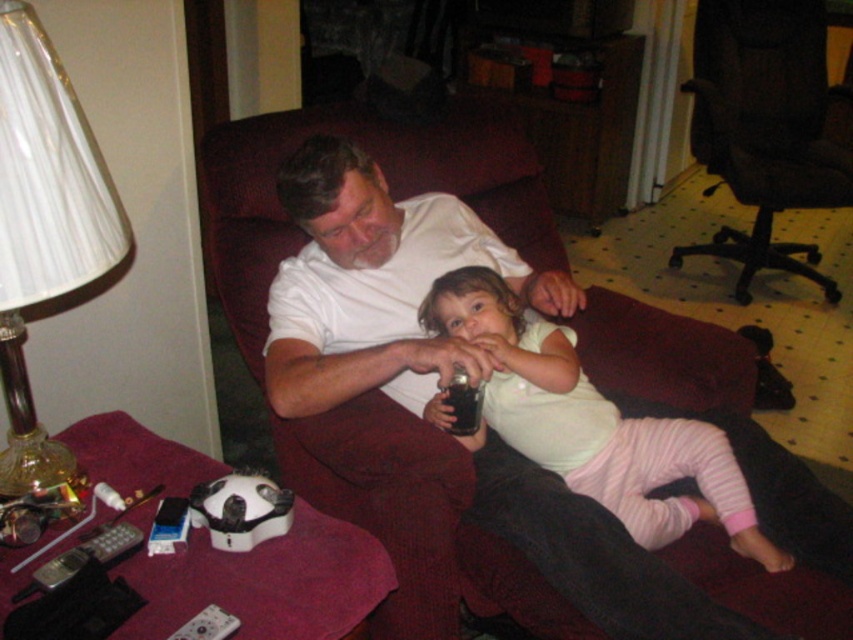
Is maroon fabric couch at center positioned before white pleated lampshade at left?

No, it is behind white pleated lampshade at left.

Between point (222, 300) and point (102, 193), which one is positioned behind?

Positioned behind is point (222, 300).

You are a GUI agent. You are given a task and a screenshot of the screen. Output one action in this format:
    pyautogui.click(x=<x>, y=<y>)
    Task: Click on the maroon fabric couch at center
    The height and width of the screenshot is (640, 853).
    Given the screenshot: What is the action you would take?
    pyautogui.click(x=517, y=538)

Who is shorter, white matte shirt at center or white cotton shirt at upper center?

white matte shirt at center is shorter.

Who is positioned more to the right, white matte shirt at center or white cotton shirt at upper center?

white cotton shirt at upper center is more to the right.

Which is in front, point (392, 336) or point (642, 532)?

Point (642, 532)

Locate an element on the screen. The width and height of the screenshot is (853, 640). white matte shirt at center is located at coordinates (375, 284).

Does maroon fabric couch at center have a larger size compared to white cotton shirt at upper center?

Indeed, maroon fabric couch at center has a larger size compared to white cotton shirt at upper center.

Can you confirm if maroon fabric couch at center is positioned to the left of white cotton shirt at upper center?

Correct, you'll find maroon fabric couch at center to the left of white cotton shirt at upper center.

Identify the location of maroon fabric couch at center. This screenshot has height=640, width=853. (517, 538).

Locate an element on the screen. This screenshot has width=853, height=640. maroon fabric couch at center is located at coordinates (517, 538).